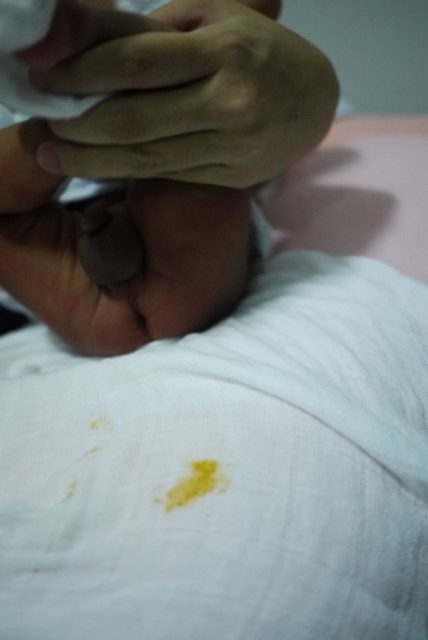
Based on the scene description, where is the smooth skin hand at upper center located in the image?

The smooth skin hand at upper center is located at point [187,96].

You are a healthcare professional examining the patient in the image. You notice two hands, the smooth skin hand at upper center and the smooth skin hand at center. Which hand is positioned to the right of the other?

The smooth skin hand at upper center is to the right of the smooth skin hand at center.

You are a medical professional examining the patient in the image. You notice two hands, the smooth skin hand at upper center and the smooth skin hand at center. Which hand is wider?

The smooth skin hand at upper center has a lesser width compared to the smooth skin hand at center, so the smooth skin hand at center is wider.